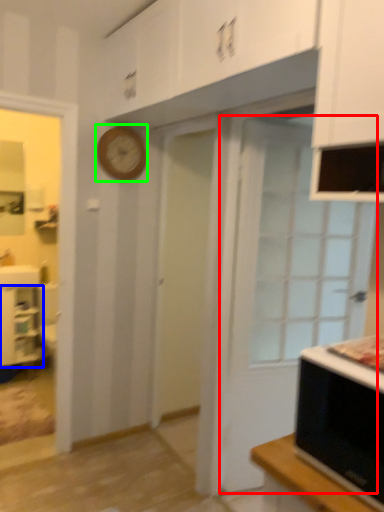
Question: Which object is positioned closest to door (highlighted by a red box)? Select from cabinetry (highlighted by a blue box) and clock (highlighted by a green box).

Choices:
 (A) cabinetry
 (B) clock

Answer: (B)